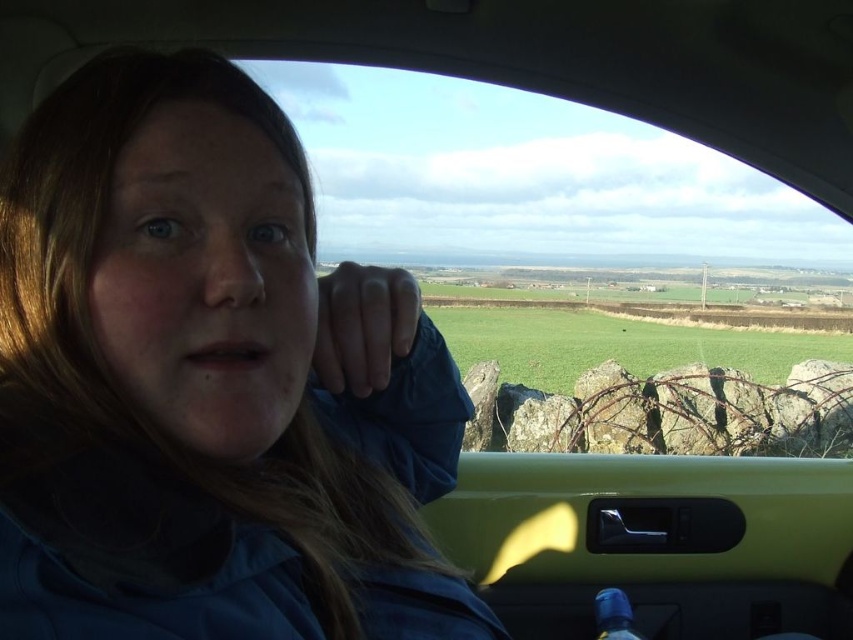
You are inside the car and want to know which point is closer to you. The points are point (254, 636) and point (624, 593). Which point is closer to you?

Point (254, 636) is closer to the camera than point (624, 593).

You are sitting in the passenger seat of a car and notice two blue items. The blue fabric at left and the blue matte bottle at lower center. Which one is larger?

The blue matte bottle at lower center is larger than the blue fabric at left.